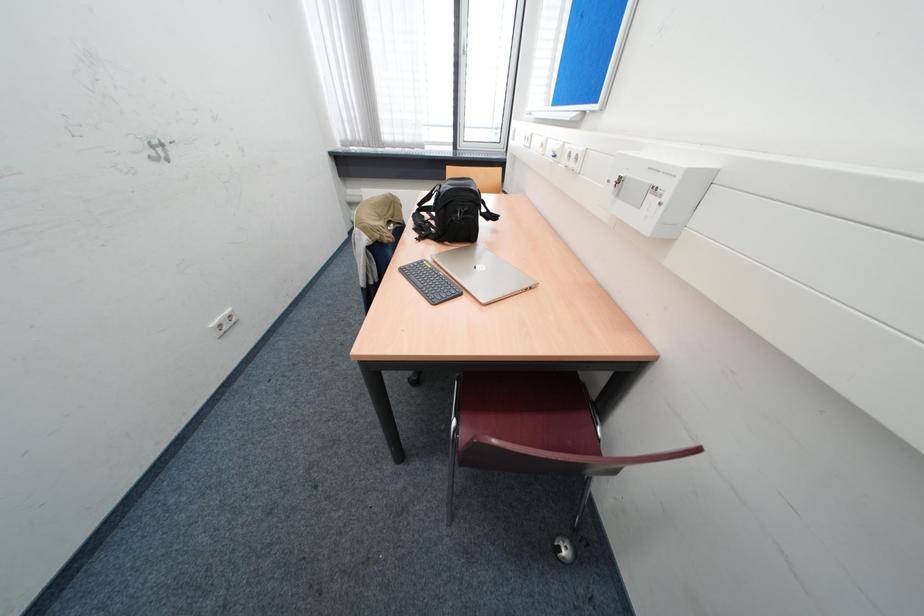
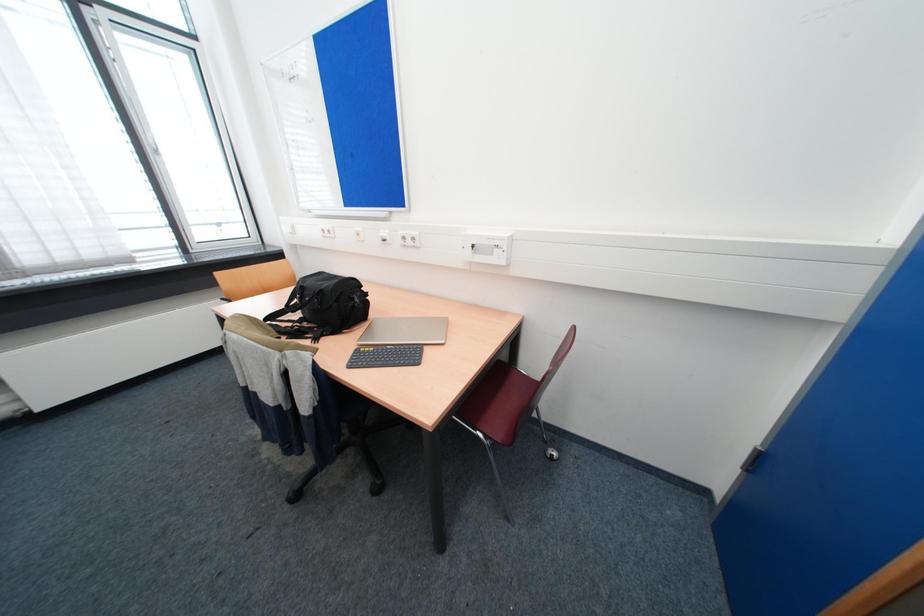
Question: The first image is from the beginning of the video and the second image is from the end. How did the camera likely rotate when shooting the video?

Choices:
 (A) Left
 (B) Right
 (C) Up
 (D) Down

Answer: (B)